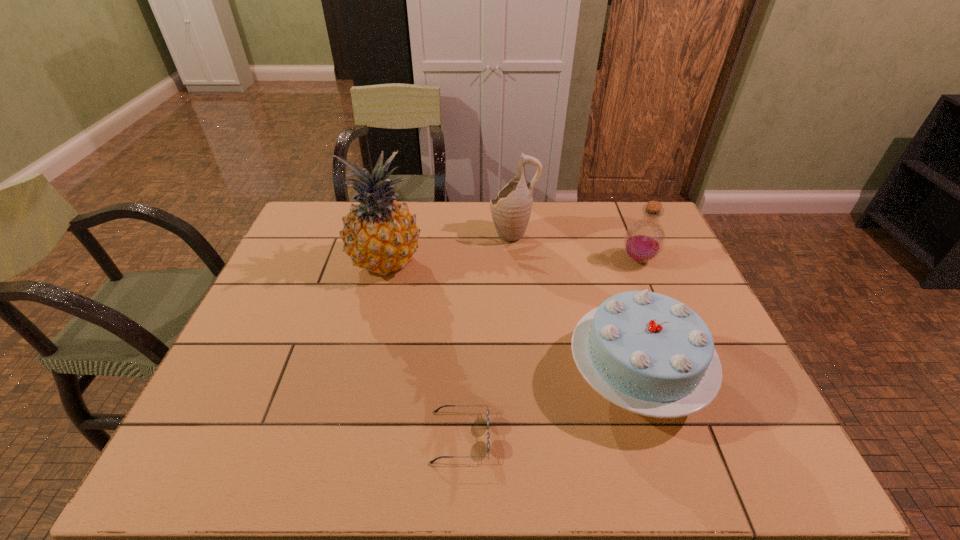
Find the location of a particular element. This screenshot has width=960, height=540. free space that satisfies the following two spatial constraints: 1. at the spout of the third object from left to right; 2. on the back side of the bottle is located at coordinates (516, 260).

Find the location of a particular element. free spot that satisfies the following two spatial constraints: 1. at the spout of the birthday cake; 2. on the left side of the fourth shortest object is located at coordinates (526, 375).